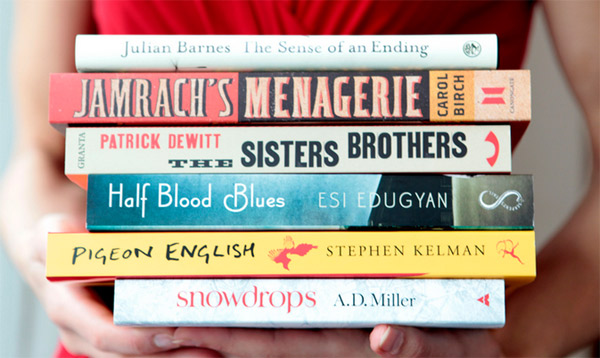
Find the location of a particular element. book spine is located at coordinates (280, 47), (278, 89), (268, 137), (272, 197), (274, 247), (277, 290).